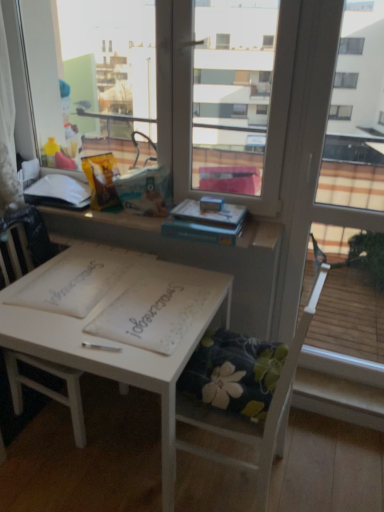
Locate an element on the screen. This screenshot has height=512, width=384. free space above white painted wood table at center (from a real-world perspective) is located at coordinates (119, 297).